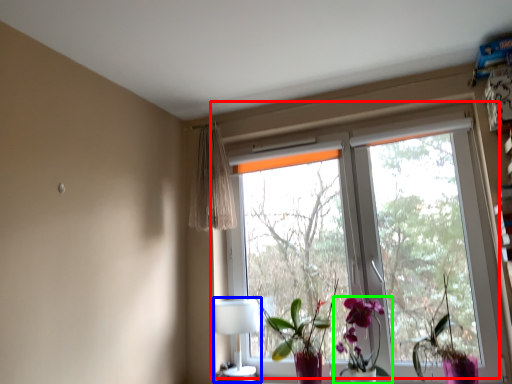
Question: Which is farther away from window (highlighted by a red box)? table lamp (highlighted by a blue box) or houseplant (highlighted by a green box)?

Choices:
 (A) table lamp
 (B) houseplant

Answer: (A)